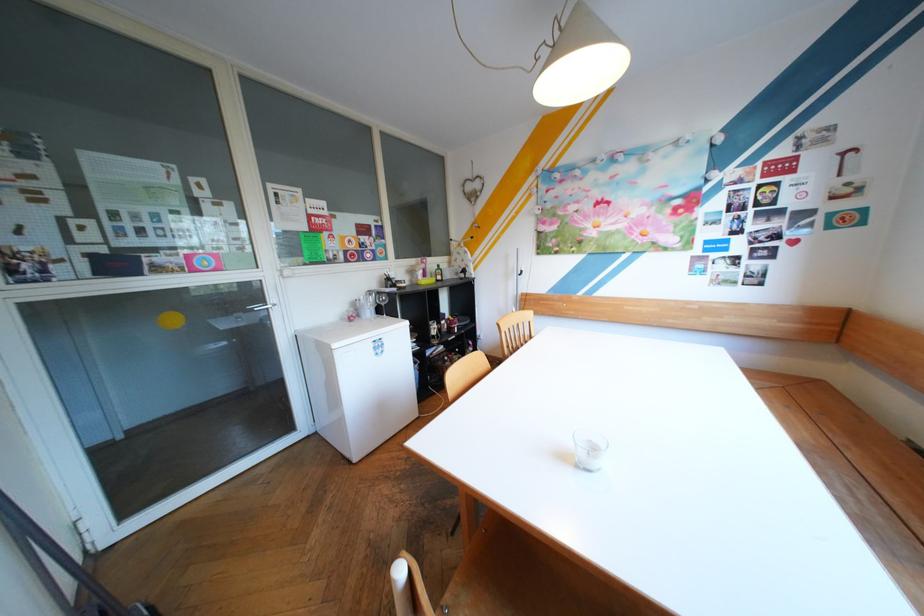
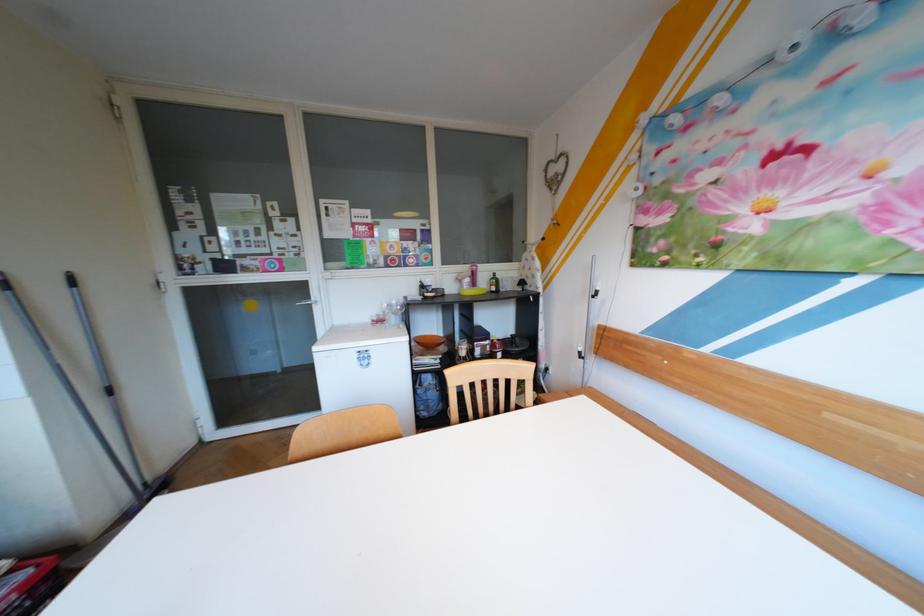
In the second image, find the point that corresponds to point 368,315 in the first image.

(393, 320)